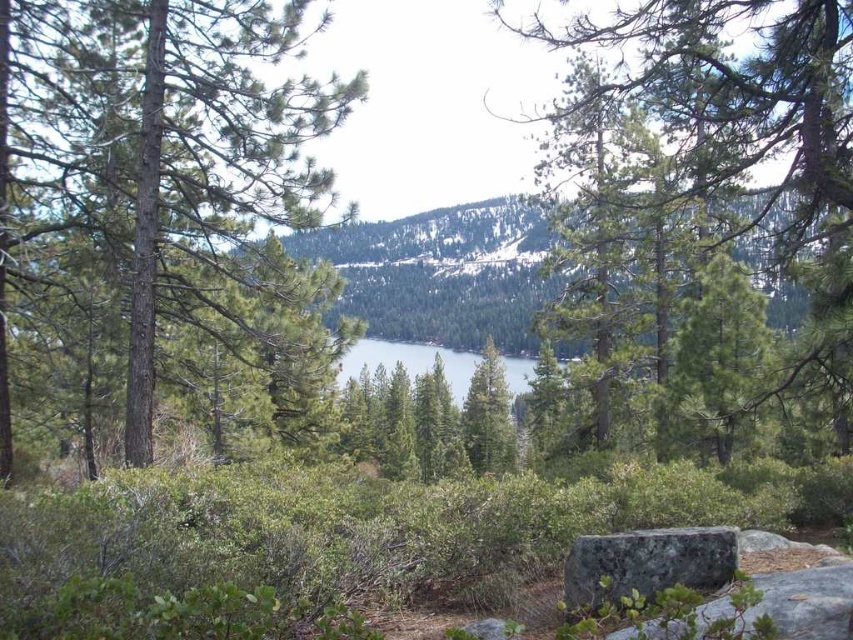
Question: Among these objects, which one is nearest to the camera?

Choices:
 (A) gray/rough rock at center
 (B) green textured pine tree at center

Answer: (A)

Question: Can you confirm if green needle-like at center is positioned below green textured pine tree at center?

Choices:
 (A) no
 (B) yes

Answer: (A)

Question: Is the position of green textured pine tree at center more distant than that of clear blue water at center?

Choices:
 (A) no
 (B) yes

Answer: (B)

Question: Considering the real-world distances, which object is closest to the green rough bark tree at center?

Choices:
 (A) gray/rough rock at center
 (B) clear blue water at center
 (C) green textured pine tree at center

Answer: (A)

Question: Among these points, which one is farthest from the camera?

Choices:
 (A) (502, 381)
 (B) (119, 168)
 (C) (430, 358)

Answer: (C)

Question: Is gray/rough rock at center thinner than green textured pine tree at center?

Choices:
 (A) yes
 (B) no

Answer: (A)